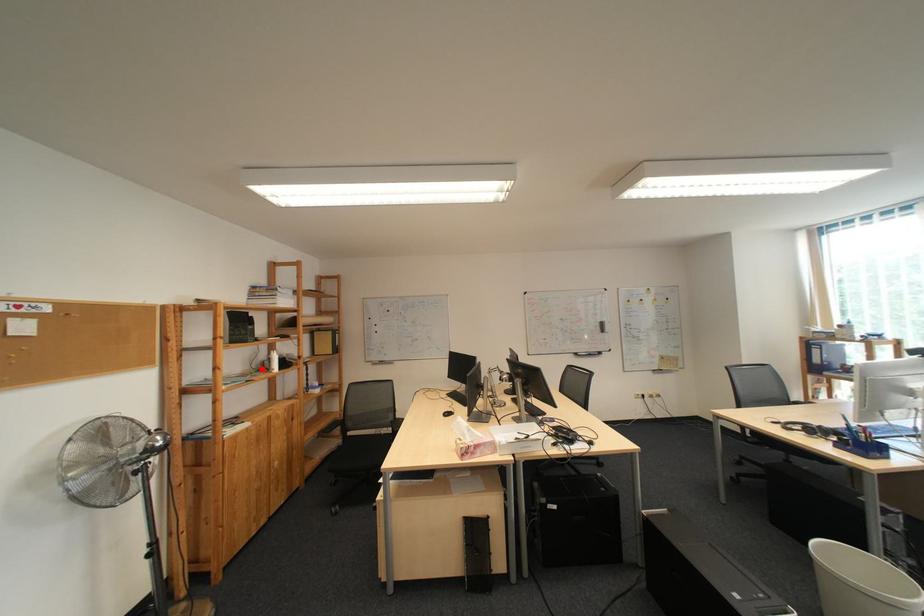
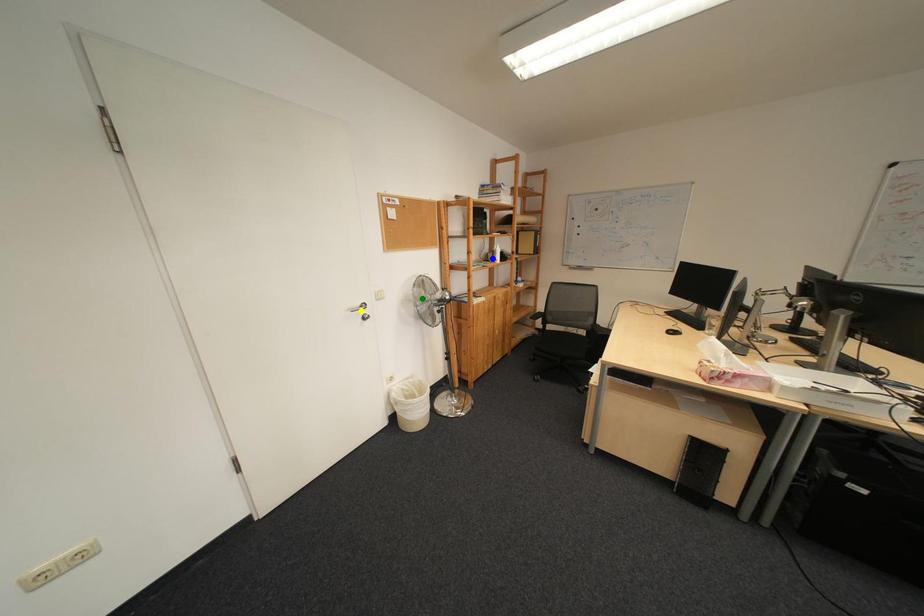
Question: I am providing you with two images of the same scene from different viewpoints. A red point is marked on the first image. You are given multiple points on the second image. Which spot in image 2 lines up with the point in image 1?

Choices:
 (A) green point
 (B) yellow point
 (C) blue point

Answer: (C)